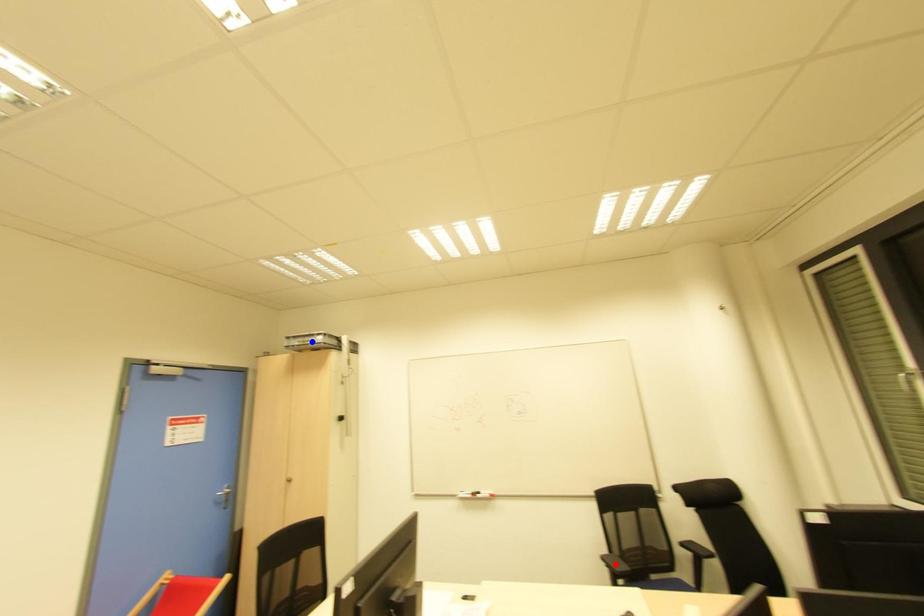
Question: Which of the two points in the image is closer to the camera?

Choices:
 (A) Blue point is closer.
 (B) Red point is closer.

Answer: (B)